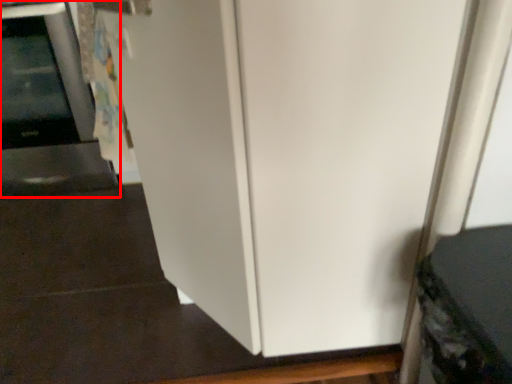
Question: From the image's perspective, what is the correct spatial positioning of appliance (annotated by the red box) in reference to appliance?

Choices:
 (A) below
 (B) above

Answer: (B)